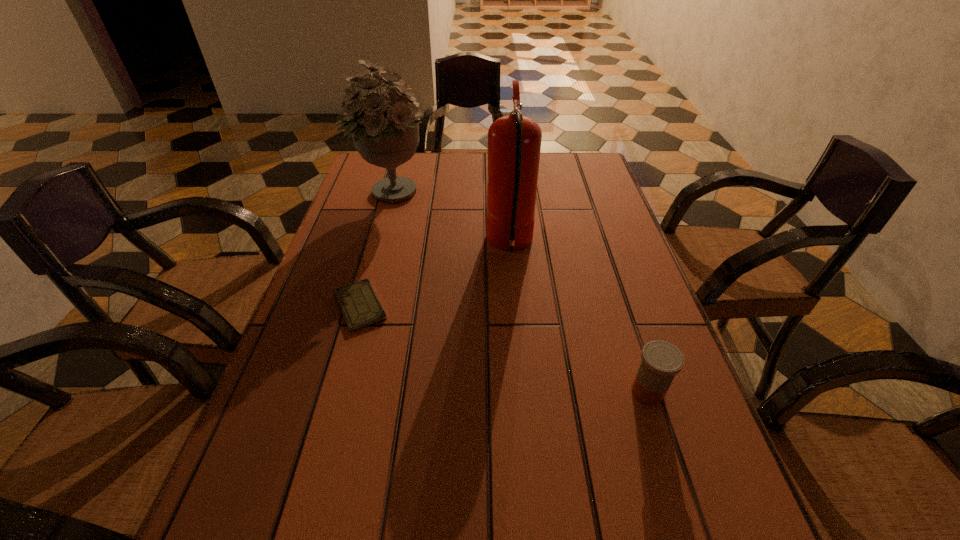
Where is `free space that is in between the third nearest object and the bouquet`? The image size is (960, 540). free space that is in between the third nearest object and the bouquet is located at coordinates (450, 219).

Identify the location of free space between the fire extinguisher and the shortest object. The image size is (960, 540). (435, 275).

In order to click on empty space that is in between the third tallest object and the fire extinguisher in this screenshot , I will do `click(579, 319)`.

You are a GUI agent. You are given a task and a screenshot of the screen. Output one action in this format:
    pyautogui.click(x=<x>, y=<y>)
    Task: Click on the vacant area that lies between the medicine and the shortest object
    The image size is (960, 540).
    Given the screenshot: What is the action you would take?
    pyautogui.click(x=504, y=349)

What are the coordinates of `object that ranks as the third closest to the fire extinguisher` in the screenshot? It's located at (661, 361).

Select which object appears as the third closest to the bouquet. Please provide its 2D coordinates. Your answer should be formatted as a tuple, i.e. [(x, y)], where the tuple contains the x and y coordinates of a point satisfying the conditions above.

[(661, 361)]

The width and height of the screenshot is (960, 540). I want to click on vacant space that satisfies the following two spatial constraints: 1. on the front side of the checkbook; 2. on the right side of the farthest object, so 358,306.

This screenshot has height=540, width=960. Identify the location of vacant space that satisfies the following two spatial constraints: 1. on the front side of the checkbook; 2. on the right side of the bouquet. (358, 306).

Identify the location of free region that satisfies the following two spatial constraints: 1. on the front side of the farthest object; 2. on the right side of the checkbook. The height and width of the screenshot is (540, 960). (358, 306).